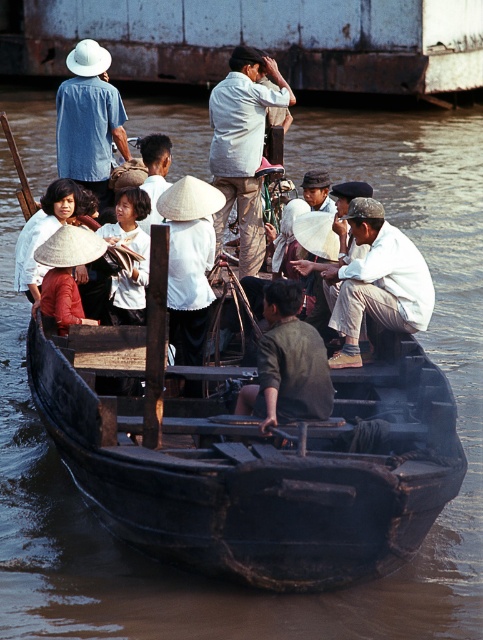
You are a photographer on the boat and want to capture both the white cotton hat at center and the white straw hat at center in a single frame. Which hat should you adjust your camera to focus on first if you want to ensure both are in the shot?

The white cotton hat at center is positioned on the right side of white straw hat at center, so you should focus on the white straw hat at center first to ensure both hats are within the camera frame.

You are a photographer on the boat and want to capture both the light beige cotton shirt at center and the matte blue shirt at upper left in the same frame. Which shirt should you focus on to ensure both are in focus, considering their heights?

The light beige cotton shirt at center is much taller than the matte blue shirt at upper left, so focusing on the taller one would help ensure both are in focus.